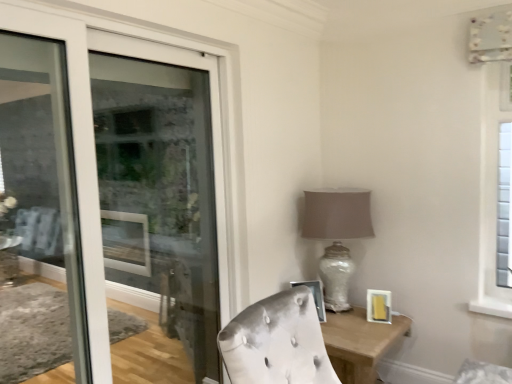
The image size is (512, 384). I want to click on empty space that is in between matte glass table lamp at center-right and metallic silver picture frame at center, arranged as the 2th picture frame when viewed from the right, so click(330, 325).